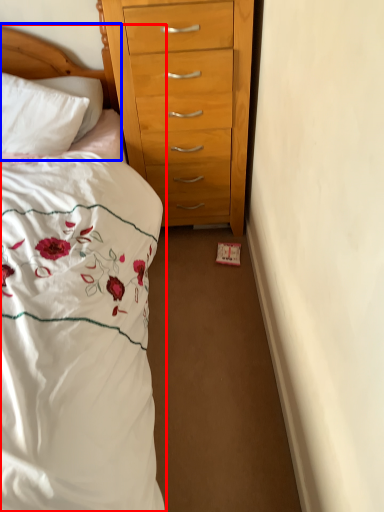
Question: Among these objects, which one is farthest to the camera, bed (highlighted by a red box) or headboard (highlighted by a blue box)?

Choices:
 (A) bed
 (B) headboard

Answer: (B)